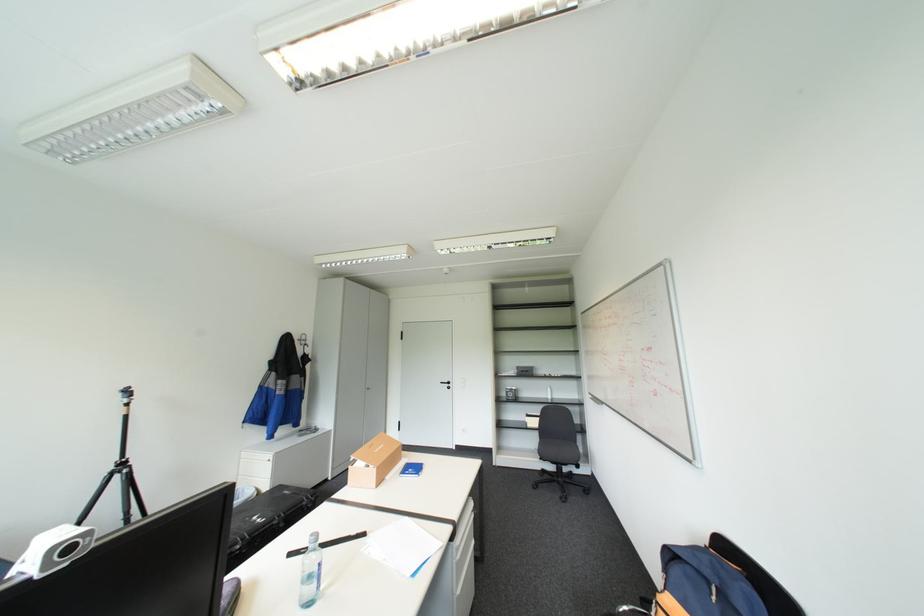
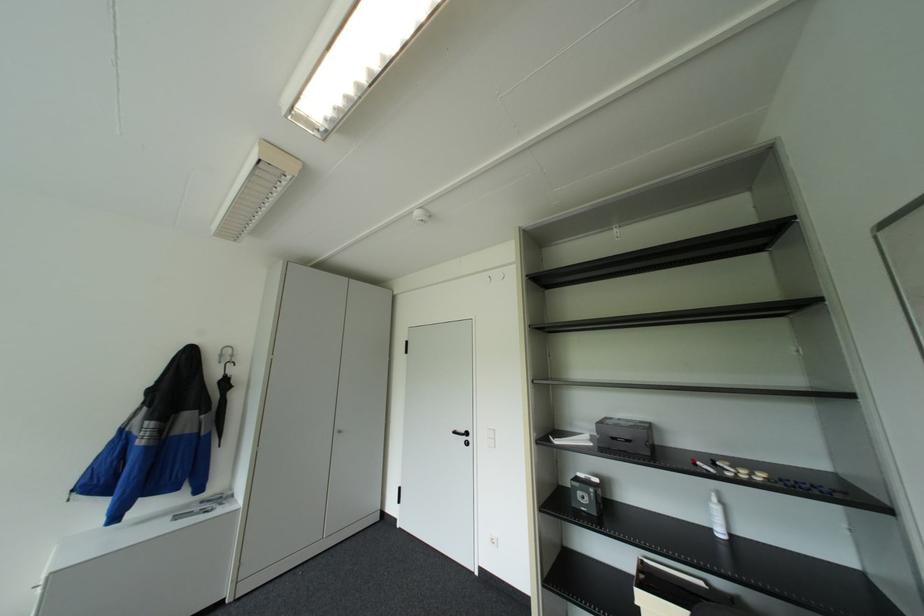
Locate, in the second image, the point that corresponds to the point at 450,381 in the first image.

(463, 431)